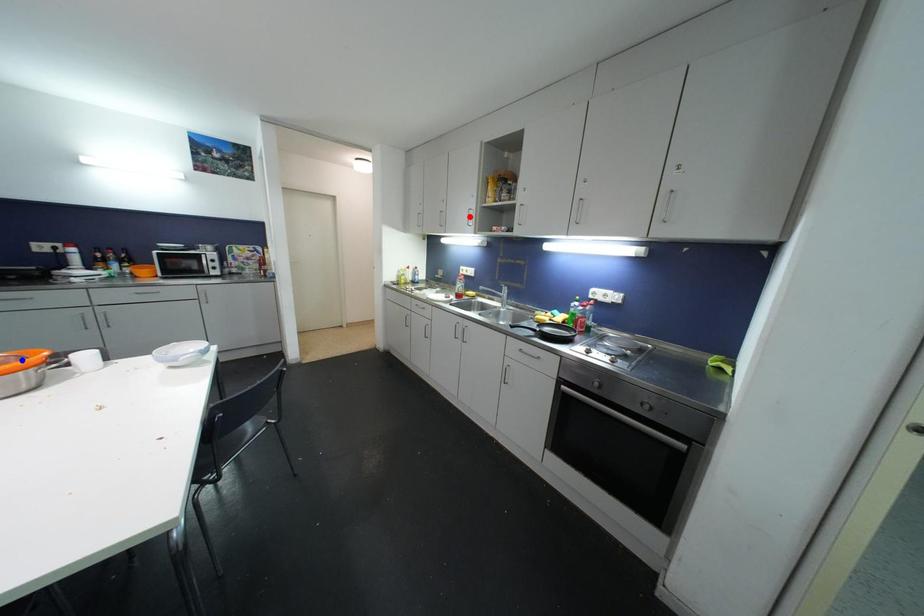
Question: Which of the two points in the image is closer to the camera?

Choices:
 (A) Blue point is closer.
 (B) Red point is closer.

Answer: (A)